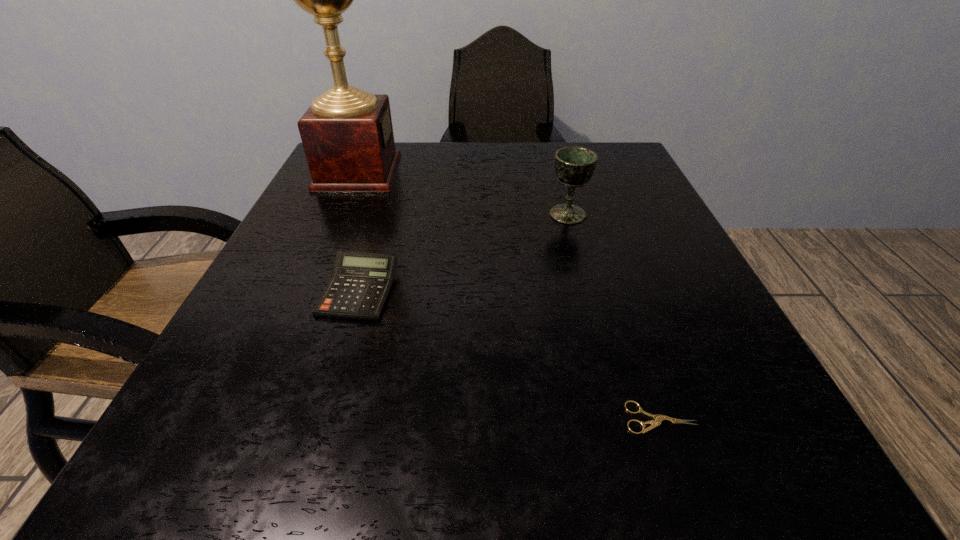
At what (x,y) coordinates should I click in order to perform the action: click on vacant point that satisfies the following two spatial constraints: 1. on the front side of the shortest object; 2. on the right side of the calculator. Please return your answer as a coordinate pair (x, y). This screenshot has width=960, height=540. Looking at the image, I should click on (321, 418).

You are a GUI agent. You are given a task and a screenshot of the screen. Output one action in this format:
    pyautogui.click(x=<x>, y=<y>)
    Task: Click on the free space that satisfies the following two spatial constraints: 1. on the plaque of the tallest object; 2. on the left side of the shears
    The height and width of the screenshot is (540, 960).
    Given the screenshot: What is the action you would take?
    pyautogui.click(x=251, y=418)

Where is `vacant space that satisfies the following two spatial constraints: 1. on the plaque of the trophy cup; 2. on the back side of the third farthest object`? vacant space that satisfies the following two spatial constraints: 1. on the plaque of the trophy cup; 2. on the back side of the third farthest object is located at coordinates (306, 291).

Where is `vacant space that satisfies the following two spatial constraints: 1. on the plaque of the third tallest object; 2. on the right side of the tallest object`? vacant space that satisfies the following two spatial constraints: 1. on the plaque of the third tallest object; 2. on the right side of the tallest object is located at coordinates (306, 291).

Locate an element on the screen. vacant region that satisfies the following two spatial constraints: 1. on the plaque of the tallest object; 2. on the right side of the nearest object is located at coordinates (251, 418).

This screenshot has height=540, width=960. I want to click on free spot that satisfies the following two spatial constraints: 1. on the back side of the shortest object; 2. on the plaque of the trophy cup, so click(576, 172).

The height and width of the screenshot is (540, 960). What are the coordinates of `free space that satisfies the following two spatial constraints: 1. on the front side of the second shortest object; 2. on the left side of the nearest object` in the screenshot? It's located at (321, 418).